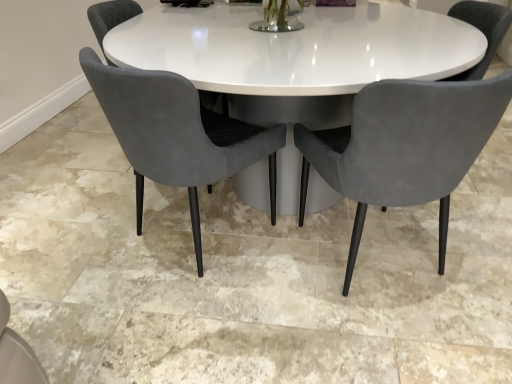
Where is `free space to the left of velvet grey chair at center, arranged as the 3th chair when viewed from the right`? Image resolution: width=512 pixels, height=384 pixels. free space to the left of velvet grey chair at center, arranged as the 3th chair when viewed from the right is located at coordinates (71, 164).